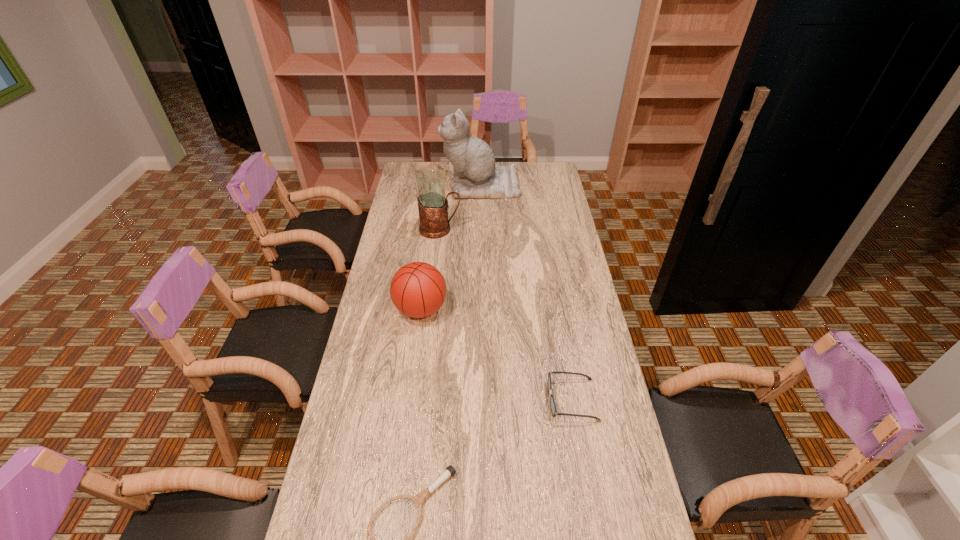
Find the location of a particular element. The width and height of the screenshot is (960, 540). vacant region located 0.130m on the front-facing side of the farthest object is located at coordinates (416, 185).

The width and height of the screenshot is (960, 540). Find the location of `free space located 0.270m with the handle on the side of the pitcher`. free space located 0.270m with the handle on the side of the pitcher is located at coordinates (521, 230).

At what (x,y) coordinates should I click in order to perform the action: click on vacant region located on the front of the third shortest object. Please return your answer as a coordinate pair (x, y). Looking at the image, I should click on (406, 418).

Find the location of `free space located 0.110m on the face of the second nearest object`. free space located 0.110m on the face of the second nearest object is located at coordinates (512, 400).

This screenshot has height=540, width=960. Identify the location of free region located 0.280m on the face of the second nearest object. (456, 400).

You are a GUI agent. You are given a task and a screenshot of the screen. Output one action in this format:
    pyautogui.click(x=<x>, y=<y>)
    Task: Click on the vacant space situated 0.170m on the face of the second nearest object
    This screenshot has width=960, height=540.
    Given the screenshot: What is the action you would take?
    pyautogui.click(x=492, y=400)

The height and width of the screenshot is (540, 960). I want to click on object at the far edge, so click(x=475, y=174).

The width and height of the screenshot is (960, 540). Find the location of `pitcher that is at the left edge`. pitcher that is at the left edge is located at coordinates (432, 201).

This screenshot has width=960, height=540. I want to click on basketball located at the left edge, so click(x=418, y=289).

The height and width of the screenshot is (540, 960). Identify the location of object that is at the right edge. 552,402.